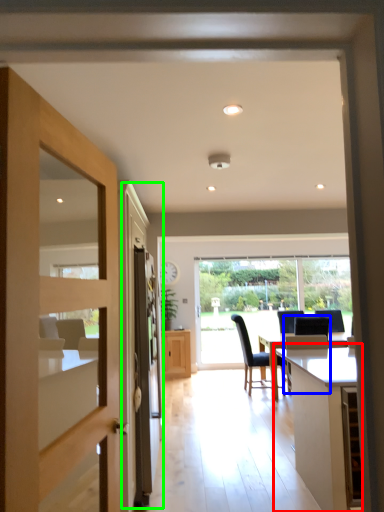
Question: Estimate the real-world distances between objects in this image. Which object is farther from table (highlighted by a red box), chair (highlighted by a blue box) or screen door (highlighted by a green box)?

Choices:
 (A) chair
 (B) screen door

Answer: (B)